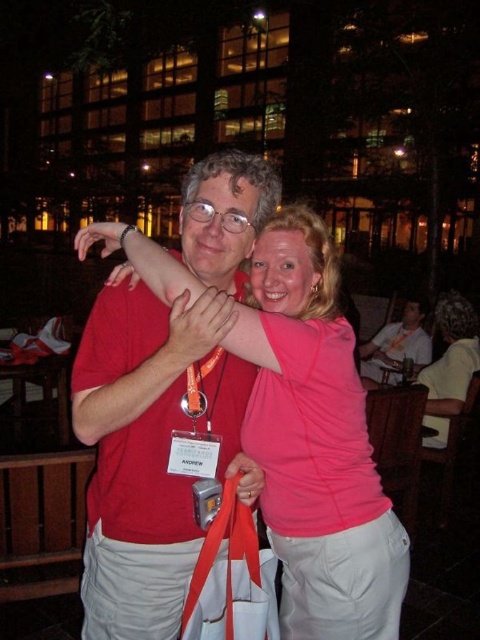
Question: Is matte red shirt at center below light brown wooden chair at lower right?

Choices:
 (A) no
 (B) yes

Answer: (A)

Question: Which point is farther to the camera?

Choices:
 (A) light brown wooden chair at lower right
 (B) orange fabric lanyard at center

Answer: (A)

Question: Does matte red shirt at center appear under orange fabric lanyard at center?

Choices:
 (A) no
 (B) yes

Answer: (B)

Question: Which object is the farthest from the orange fabric lanyard at center?

Choices:
 (A) light brown wooden chair at lower right
 (B) matte red shirt at center

Answer: (A)

Question: Among these objects, which one is nearest to the camera?

Choices:
 (A) orange fabric lanyard at center
 (B) light brown wooden chair at lower right

Answer: (A)

Question: Is matte red shirt at center to the right of orange fabric lanyard at center from the viewer's perspective?

Choices:
 (A) yes
 (B) no

Answer: (B)